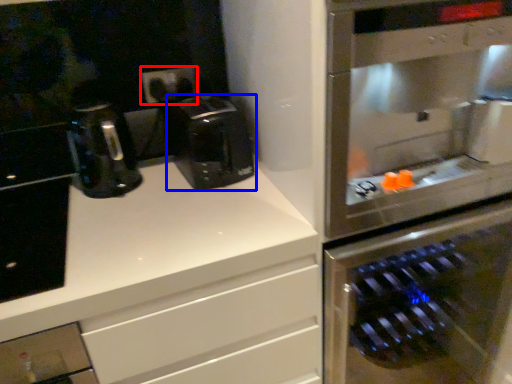
Question: Which of the following is the closest to the observer, electric outlet (highlighted by a red box) or coffee maker (highlighted by a blue box)?

Choices:
 (A) electric outlet
 (B) coffee maker

Answer: (B)